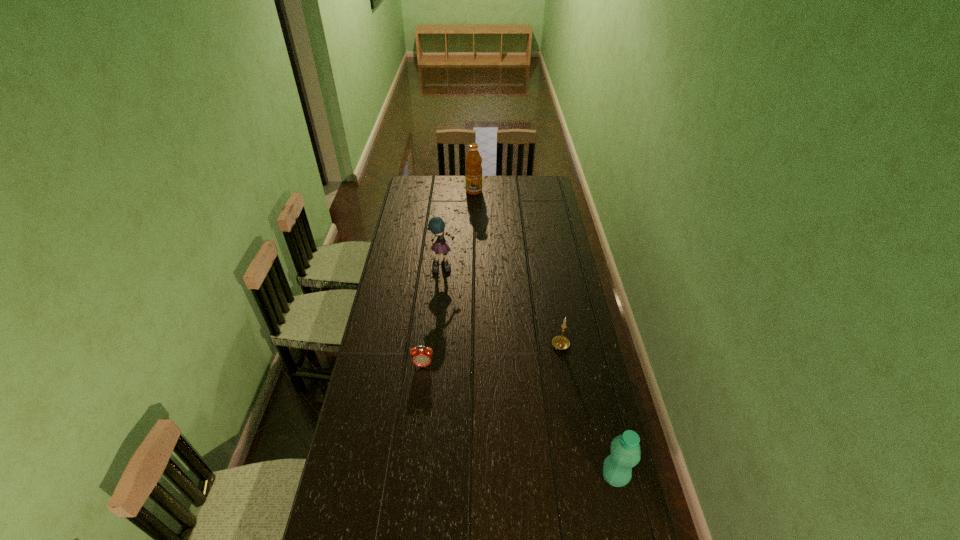
You are a GUI agent. You are given a task and a screenshot of the screen. Output one action in this format:
    pyautogui.click(x=<x>, y=<y>)
    Task: Click on the shortest object
    The height and width of the screenshot is (540, 960).
    Given the screenshot: What is the action you would take?
    pyautogui.click(x=421, y=357)

Locate an element on the screen. the fourth farthest object is located at coordinates (421, 357).

At what (x,y) coordinates should I click in order to perform the action: click on the nearest object. Please return your answer as a coordinate pair (x, y). The image size is (960, 540). Looking at the image, I should click on coord(625,450).

In order to click on the rightmost object in this screenshot , I will do `click(625, 450)`.

I want to click on rag doll, so click(x=436, y=225).

Image resolution: width=960 pixels, height=540 pixels. In order to click on fruit juice in this screenshot , I will do `click(473, 171)`.

I want to click on the farthest object, so click(473, 171).

I want to click on the second shortest object, so click(x=560, y=342).

Where is `candle holder`? The height and width of the screenshot is (540, 960). candle holder is located at coordinates (560, 342).

Find the location of a particular element. vacant point located on the face of the alarm clock is located at coordinates (419, 401).